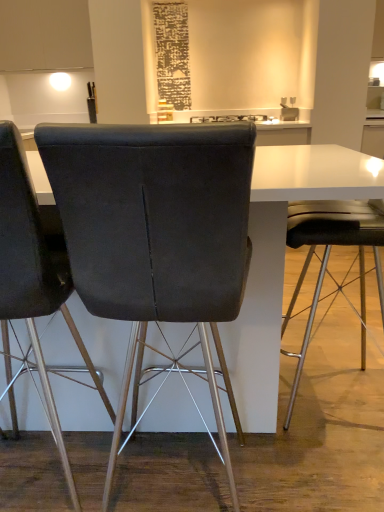
Question: Is dark gray fabric chair at center, which is the 2th chair in right-to-left order, turned away from matte white sink at upper center?

Choices:
 (A) yes
 (B) no

Answer: (B)

Question: From a real-world perspective, does dark gray fabric chair at center, which ranks as the 2th chair in left-to-right order, sit lower than matte white sink at upper center?

Choices:
 (A) no
 (B) yes

Answer: (B)

Question: Is dark gray fabric chair at center, which is the 2th chair in right-to-left order, closer to the viewer compared to matte white sink at upper center?

Choices:
 (A) yes
 (B) no

Answer: (A)

Question: From the image's perspective, does dark gray fabric chair at center, which ranks as the 2th chair in left-to-right order, appear higher than matte white sink at upper center?

Choices:
 (A) no
 (B) yes

Answer: (A)

Question: Can you confirm if dark gray fabric chair at center, which ranks as the 2th chair in left-to-right order, is bigger than matte white sink at upper center?

Choices:
 (A) yes
 (B) no

Answer: (A)

Question: From a real-world perspective, does dark gray fabric chair at center, which ranks as the 2th chair in left-to-right order, stand above matte white sink at upper center?

Choices:
 (A) yes
 (B) no

Answer: (B)

Question: Can you confirm if matte white sink at upper center is bigger than velvet dark gray chair at left, acting as the 3th chair starting from the right?

Choices:
 (A) yes
 (B) no

Answer: (B)

Question: Does matte white sink at upper center appear on the left side of velvet dark gray chair at left, the first chair positioned from the left?

Choices:
 (A) yes
 (B) no

Answer: (B)

Question: Could you tell me if matte white sink at upper center is turned towards velvet dark gray chair at left, acting as the 3th chair starting from the right?

Choices:
 (A) no
 (B) yes

Answer: (A)

Question: Considering the relative sizes of matte white sink at upper center and velvet dark gray chair at left, the first chair positioned from the left, in the image provided, is matte white sink at upper center shorter than velvet dark gray chair at left, the first chair positioned from the left,?

Choices:
 (A) no
 (B) yes

Answer: (B)

Question: Considering the relative sizes of matte white sink at upper center and velvet dark gray chair at left, the first chair positioned from the left, in the image provided, is matte white sink at upper center taller than velvet dark gray chair at left, the first chair positioned from the left,?

Choices:
 (A) no
 (B) yes

Answer: (A)

Question: Would you say matte white sink at upper center is outside velvet dark gray chair at left, the first chair positioned from the left?

Choices:
 (A) yes
 (B) no

Answer: (A)

Question: Is dark gray fabric chair at center, which is the 2th chair in right-to-left order, far from black glossy toaster at center?

Choices:
 (A) no
 (B) yes

Answer: (B)